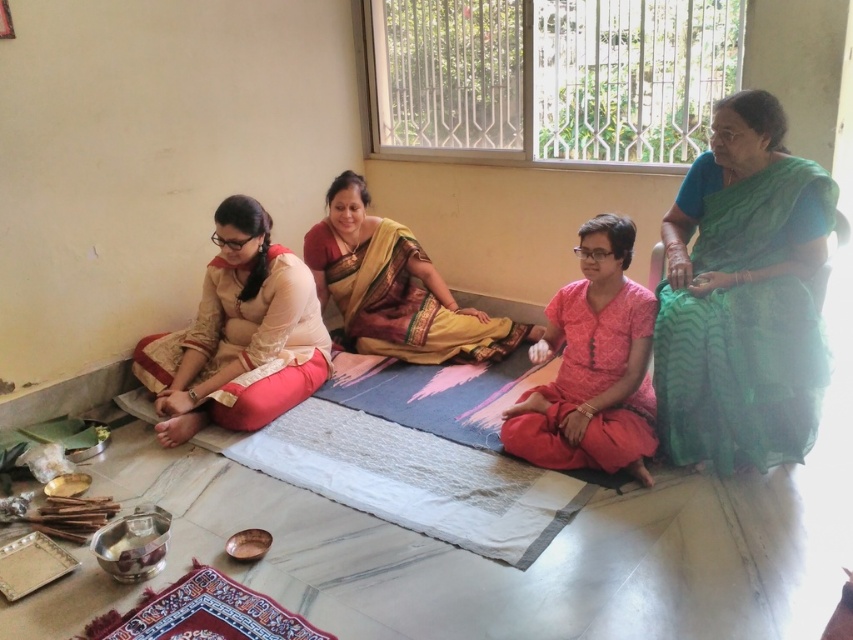
You are a photographer planning to take a group photo of the women in the scene. You need to ensure that both the green sheer saree at right and the pink cotton kurta at center are fully visible in the frame. Given their sizes, which garment should you position closer to the camera to avoid any part of it being cut off?

The green sheer saree at right is bigger than the pink cotton kurta at center. To ensure both are fully visible, position the larger green sheer saree at right closer to the camera. This way, its larger size will occupy more of the frame, while the smaller pink cotton kurta at center can be placed slightly further back, ensuring neither is cut off.

You are an interior designer analyzing the layout of this room. The green sheer saree at right is placed at a specific coordinate. Can you determine its exact position using the coordinate system provided?

The green sheer saree at right is located at the 2D coordinate point of 0.464 on the x axis and 0.871 on the y axis.

You are standing in the room and want to pick up an object located at point (x=456, y=330) and another object at point (x=248, y=630). Which point is closer to you?

Point (x=248, y=630) is closer to you than point (x=456, y=330) because the description states that point (x=456, y=330) is further to the camera than point (x=248, y=630).